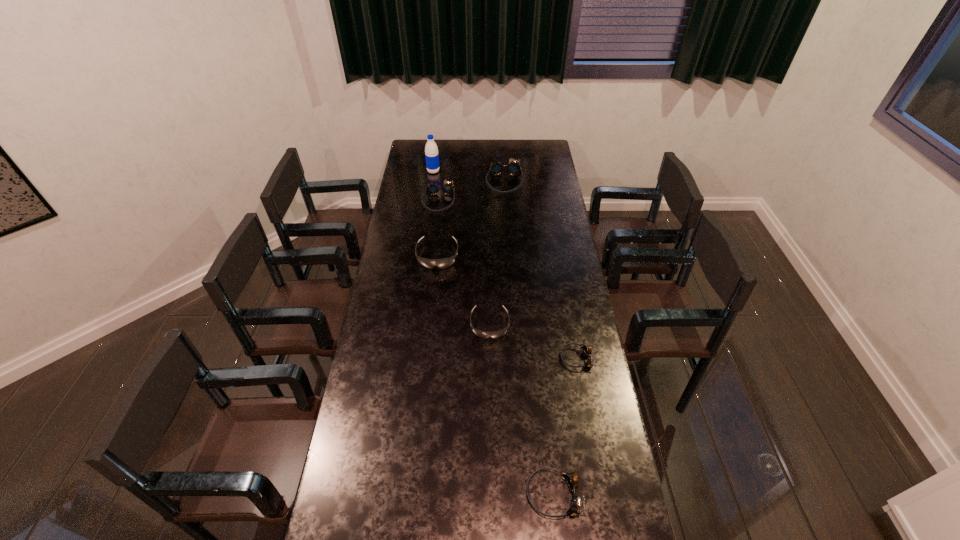
Locate which black goggles is the closest to the second nearest object. Please provide its 2D coordinates. Your answer should be formatted as a tuple, i.e. [(x, y)], where the tuple contains the x and y coordinates of a point satisfying the conditions above.

[(482, 334)]